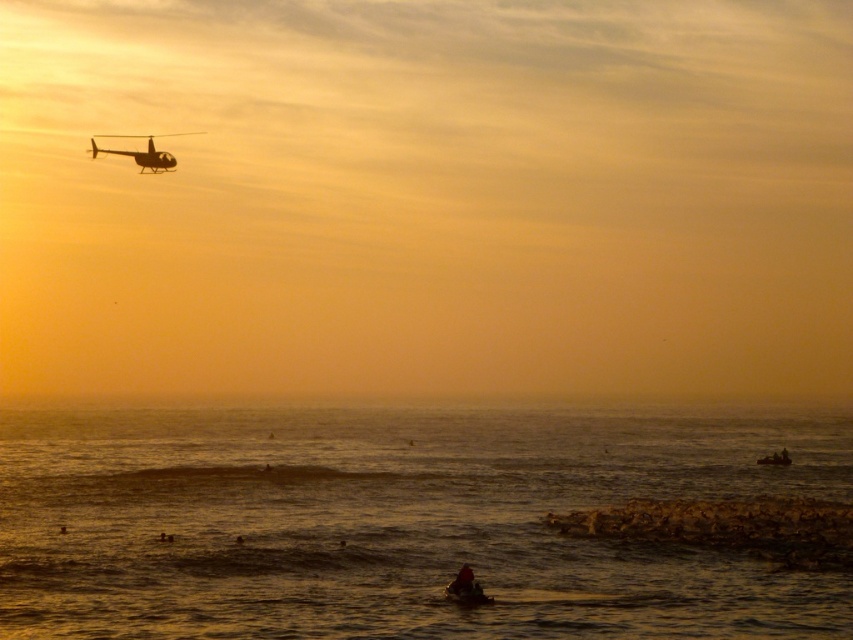
Describe the element at coordinates (395, 522) in the screenshot. Image resolution: width=853 pixels, height=640 pixels. I see `golden water at lower center` at that location.

In order to click on golden water at lower center in this screenshot , I will do `click(395, 522)`.